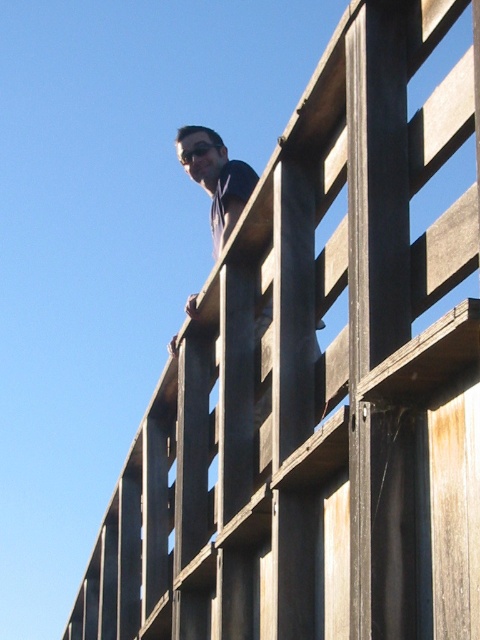
Can you confirm if matte black shirt at upper center is taller than black matte goggles at upper center?

Yes.

Does matte black shirt at upper center have a lesser height compared to black matte goggles at upper center?

No, matte black shirt at upper center is not shorter than black matte goggles at upper center.

Measure the distance between matte black shirt at upper center and camera.

A distance of 7.76 meters exists between matte black shirt at upper center and camera.

Locate an element on the screen. matte black shirt at upper center is located at coordinates (217, 180).